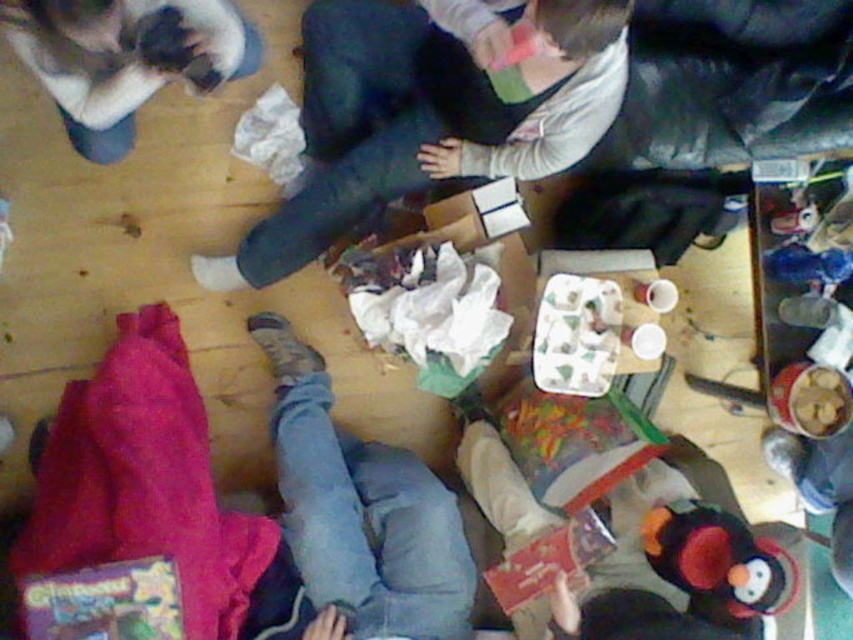
Based on the photo, you are a person sitting on the wooden floor in the center of the image. You want to reach both the fluffy white cat at upper left and the fluffy plush penguin at lower right without moving your legs. Which object is closer to you?

The fluffy plush penguin at lower right is closer to you because it is located at lower right, which is nearer to your current position in the center compared to the fluffy white cat at upper left.

You are a person sitting on the wooden floor and want to reach the fluffy plush penguin at lower right without stepping on the fluffy white cat at upper left. Is this possible?

The fluffy white cat at upper left is above the fluffy plush penguin at lower right, so you can reach the fluffy plush penguin at lower right without stepping on the fluffy white cat at upper left by moving around it.